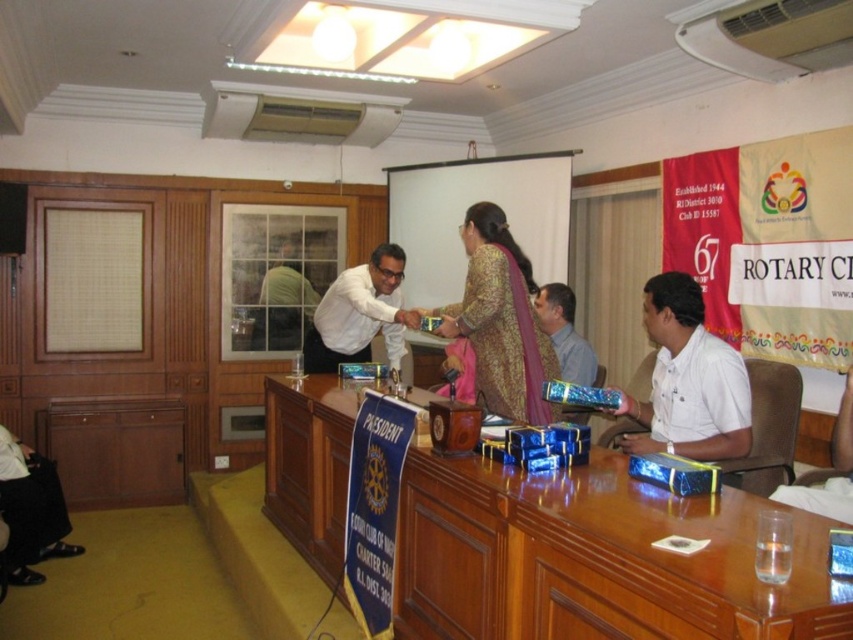
Is gold brocade dress at center to the right of white glossy shirt at center from the viewer's perspective?

Indeed, gold brocade dress at center is positioned on the right side of white glossy shirt at center.

Does gold brocade dress at center have a smaller size compared to white glossy shirt at center?

Correct, gold brocade dress at center occupies less space than white glossy shirt at center.

Between point (498, 403) and point (395, 266), which one is positioned behind?

The point (395, 266) is behind.

Identify the location of gold brocade dress at center. (500, 321).

Does wooden table at center have a smaller size compared to green fabric at center?

Actually, wooden table at center might be larger than green fabric at center.

Who is more forward, (735, 586) or (308, 280)?

Point (735, 586) is in front.

The height and width of the screenshot is (640, 853). What are the coordinates of `wooden table at center` in the screenshot? It's located at (595, 557).

Who is lower down, white cotton shirt at right or green fabric at center?

white cotton shirt at right is below.

In the scene shown: Is white cotton shirt at right smaller than green fabric at center?

Incorrect, white cotton shirt at right is not smaller in size than green fabric at center.

Between point (677, 273) and point (271, 292), which one is positioned behind?

The point (271, 292) is behind.

Locate an element on the screen. This screenshot has width=853, height=640. white cotton shirt at right is located at coordinates (688, 380).